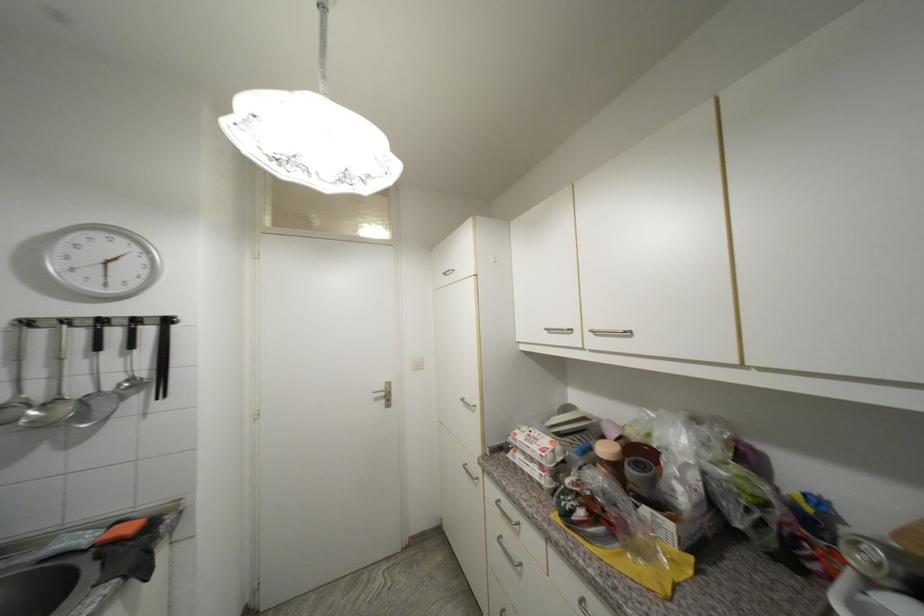
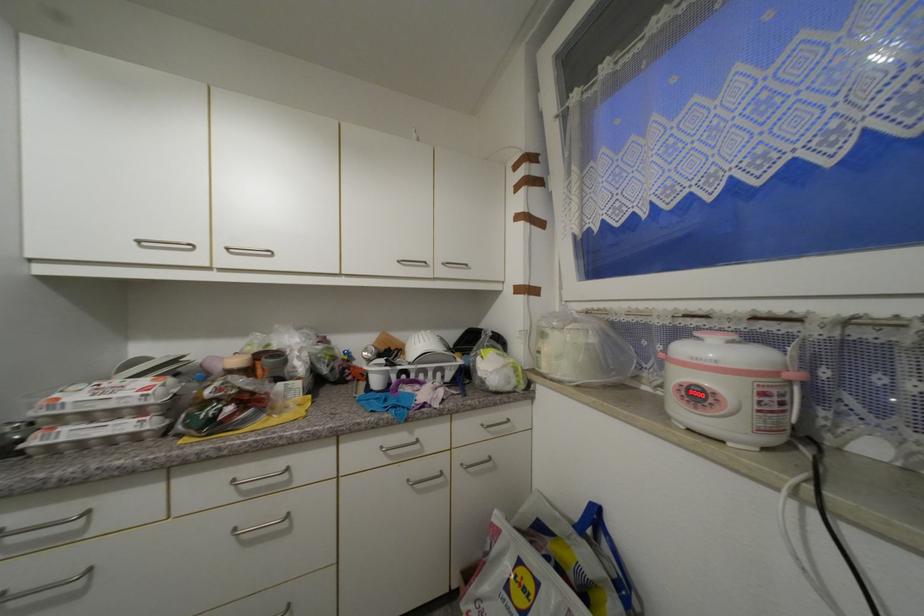
Find the pixel in the second image that matches point 521,436 in the first image.

(64, 400)